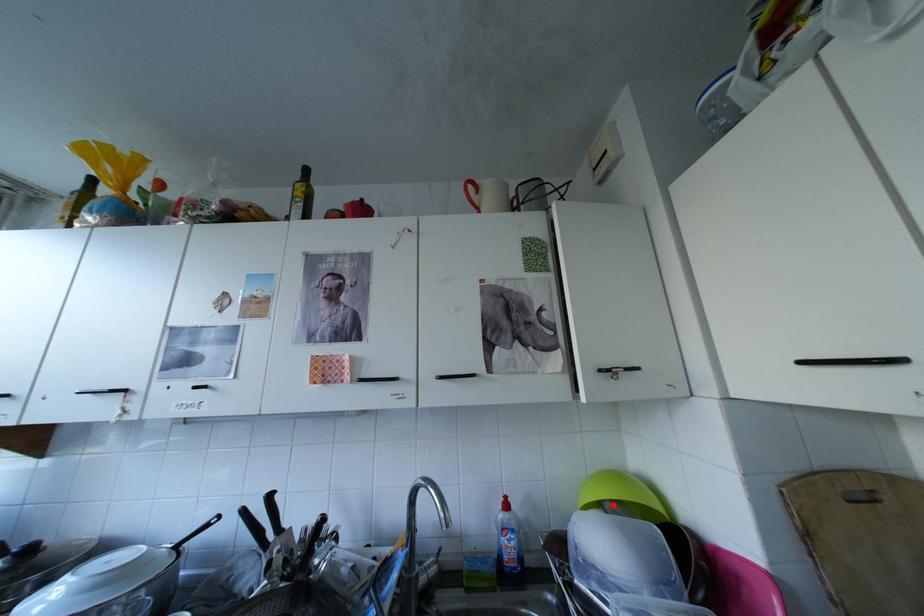
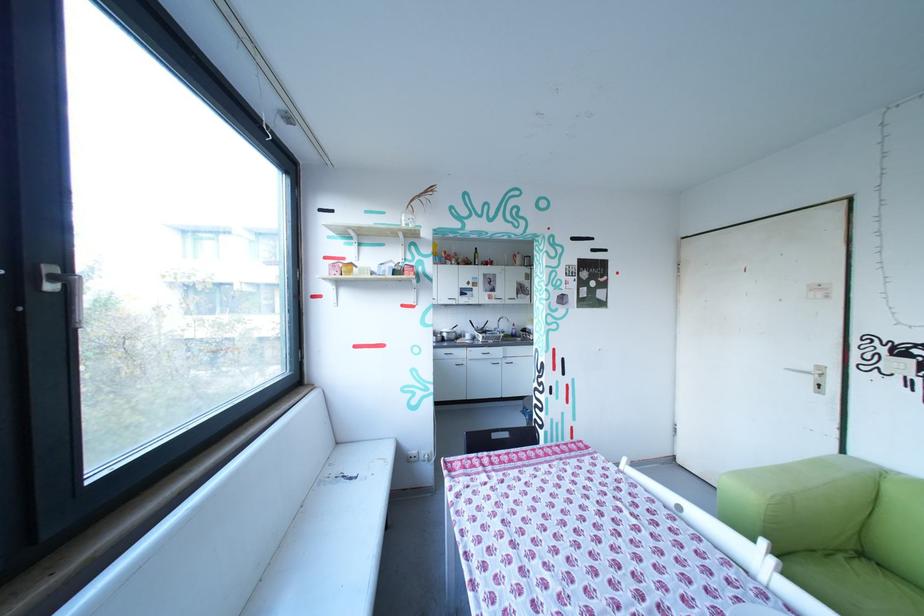
Question: I am providing you with two images of the same scene from different viewpoints. A red point is marked on the first image. Is the red point's position out of view in image 2?

Choices:
 (A) Yes
 (B) No

Answer: (A)